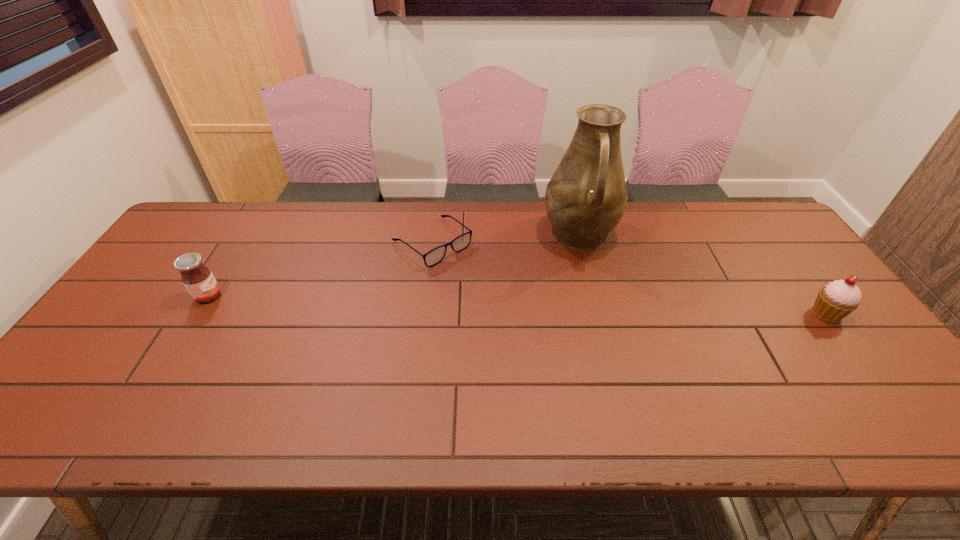
The image size is (960, 540). Identify the location of free point between the leftmost object and the shortest object. (321, 269).

At what (x,y) coordinates should I click in order to perform the action: click on free space that is in between the jam and the rightmost object. Please return your answer as a coordinate pair (x, y). Looking at the image, I should click on (517, 305).

In order to click on vacant space that's between the jam and the third object from right to left in this screenshot , I will do `click(321, 269)`.

Locate which object ranks third in proximity to the leftmost object. Please provide its 2D coordinates. Your answer should be formatted as a tuple, i.e. [(x, y)], where the tuple contains the x and y coordinates of a point satisfying the conditions above.

[(835, 301)]

Image resolution: width=960 pixels, height=540 pixels. What are the coordinates of `object that is the closest to the second object from right to left` in the screenshot? It's located at (436, 255).